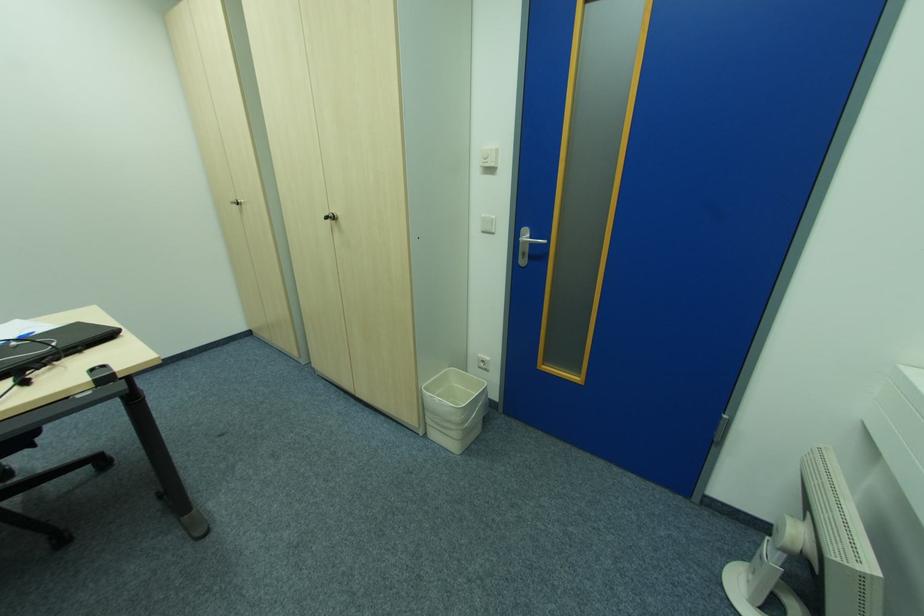
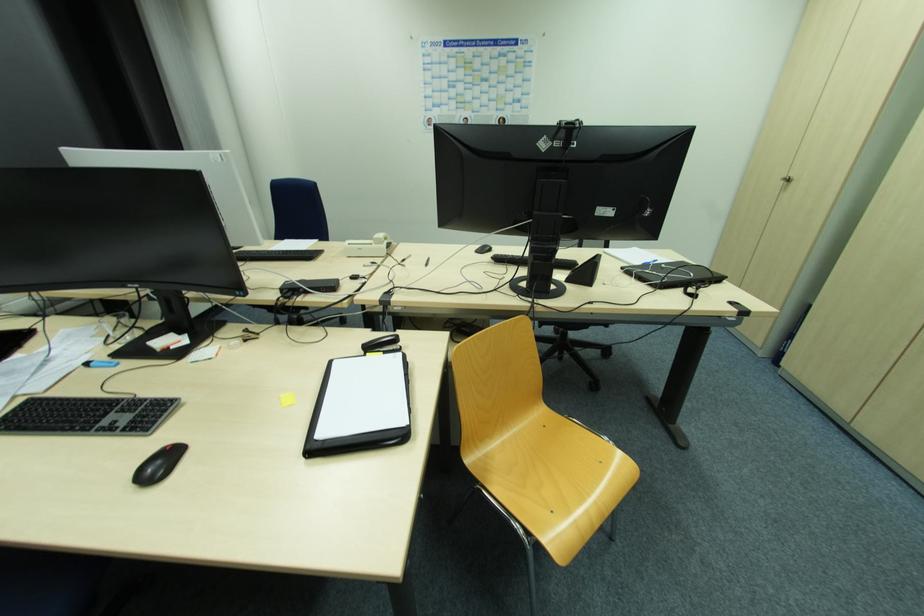
The point at (237, 207) is marked in the first image. Where is the corresponding point in the second image?

(784, 183)